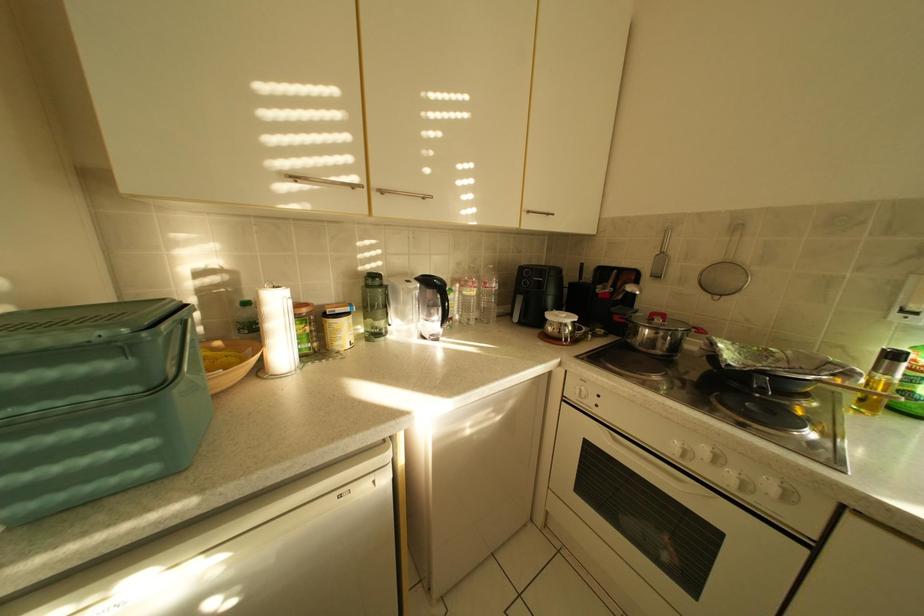
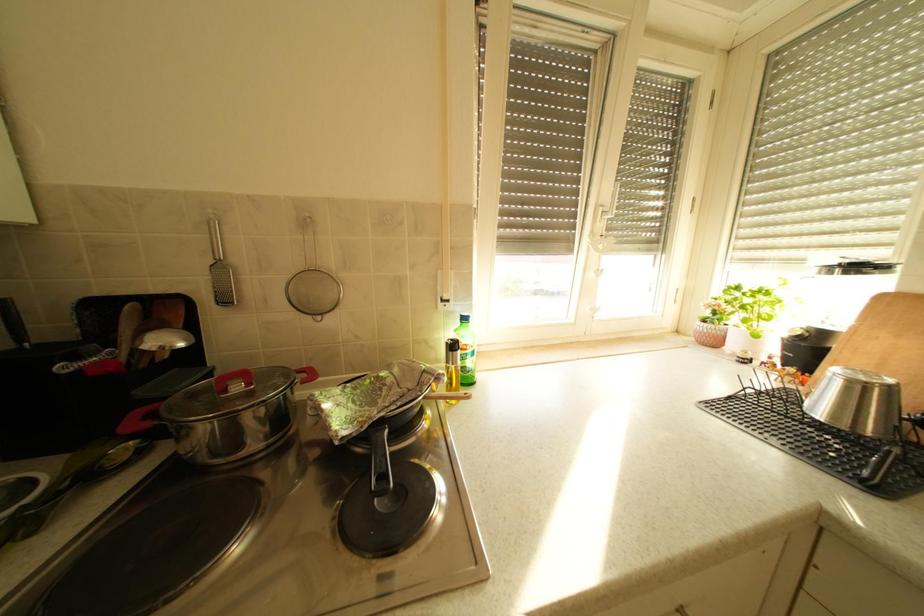
Question: The images are taken continuously from a first-person perspective. In which direction is your viewpoint rotating?

Choices:
 (A) Left
 (B) Right
 (C) Up
 (D) Down

Answer: (B)